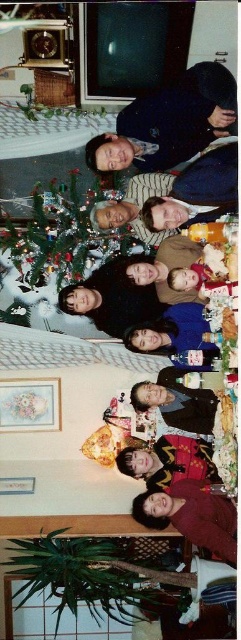
Question: Can you confirm if velvet gold jacket at center is wider than dark brown leather jacket at center?

Choices:
 (A) yes
 (B) no

Answer: (A)

Question: Which of the following is the closest to the observer?

Choices:
 (A) dark brown leather jacket at center
 (B) pastel floral fabric picture frame at lower left
 (C) blue velvet dress at center

Answer: (C)

Question: Is matte black shirt at center wider than smooth beige sweater at center?

Choices:
 (A) yes
 (B) no

Answer: (A)

Question: Which object appears farthest from the camera in this image?

Choices:
 (A) velvet gold jacket at center
 (B) matte black shirt at center
 (C) maroon sweater at lower center
 (D) dark brown leather jacket at center

Answer: (B)

Question: Does green matte christmas tree at center appear over maroon sweater at lower center?

Choices:
 (A) no
 (B) yes

Answer: (B)

Question: Among these objects, which one is farthest from the camera?

Choices:
 (A) velvet gold jacket at center
 (B) maroon sweater at lower center
 (C) green matte christmas tree at center
 (D) smooth beige sweater at center

Answer: (C)